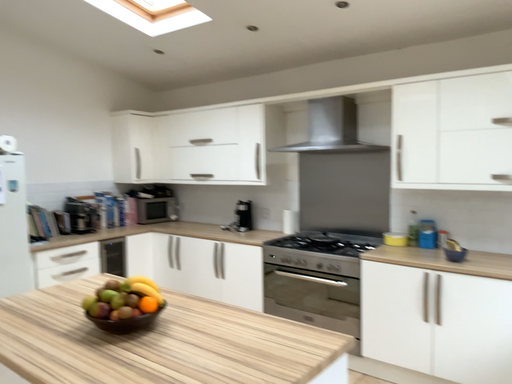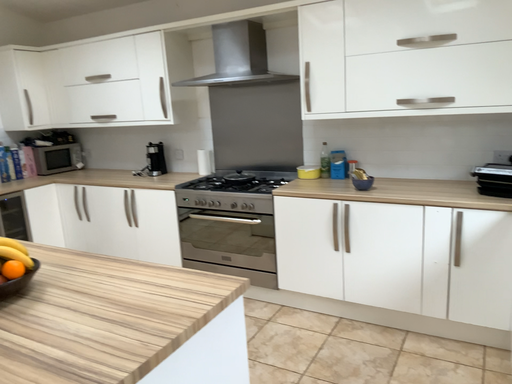
Question: Which way did the camera rotate in the video?

Choices:
 (A) rotated upward
 (B) rotated downward

Answer: (B)